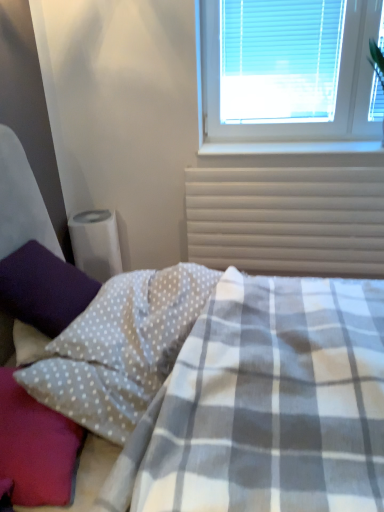
Question: In the image, is white dotted fabric pillow at lower left, acting as the second pillow starting from the right, positioned in front of or behind white plastic radiator at upper right?

Choices:
 (A) behind
 (B) front

Answer: (B)

Question: Considering the positions of white dotted fabric pillow at lower left, the second pillow positioned from the left, and white plastic radiator at upper right in the image, is white dotted fabric pillow at lower left, the second pillow positioned from the left, wider or thinner than white plastic radiator at upper right?

Choices:
 (A) wide
 (B) thin

Answer: (A)

Question: Estimate the real-world distances between objects in this image. Which object is closer to the purple fuzzy pillow at left, which is the first pillow from left to right?

Choices:
 (A) white dotted fabric pillow at lower left, the first pillow positioned from the right
 (B) white smooth window sill at lower center
 (C) white dotted fabric pillow at lower left, the second pillow positioned from the left
 (D) white plastic blinds at upper right
 (E) white plastic radiator at upper right

Answer: (A)

Question: Which object is positioned farthest from the white dotted fabric pillow at lower left, acting as the second pillow starting from the right?

Choices:
 (A) white dotted fabric pillow at lower left, the first pillow positioned from the right
 (B) purple fuzzy pillow at left, which is the first pillow from left to right
 (C) white plastic radiator at upper right
 (D) white plastic blinds at upper right
 (E) white smooth window sill at lower center

Answer: (D)